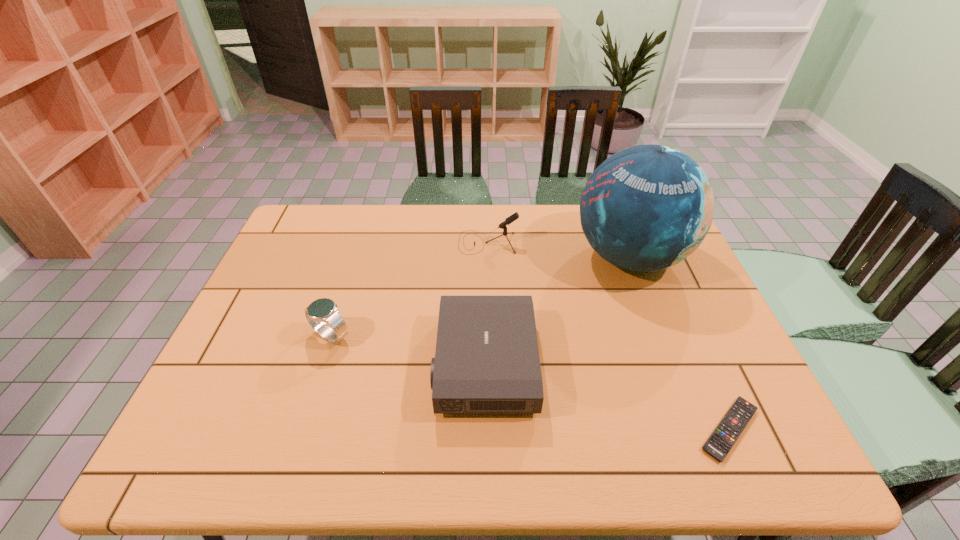
This screenshot has height=540, width=960. What are the coordinates of `the tallest object` in the screenshot? It's located at (648, 207).

The image size is (960, 540). Find the location of `microphone`. microphone is located at coordinates (513, 217).

This screenshot has width=960, height=540. Identify the location of the leftmost object. (322, 310).

Identify the location of projector. (487, 361).

Find the location of `remote control`. remote control is located at coordinates (720, 442).

Locate an element on the screen. This screenshot has height=540, width=960. free location located 0.280m on the left of the tallest object is located at coordinates (484, 257).

The height and width of the screenshot is (540, 960). In order to click on vacant area located on the stand of the microphone in this screenshot , I will do `click(380, 242)`.

Where is `vacant point located on the stand of the microphone`? Image resolution: width=960 pixels, height=540 pixels. vacant point located on the stand of the microphone is located at coordinates (337, 242).

Where is `vacant position located on the stand of the microphone`? This screenshot has width=960, height=540. vacant position located on the stand of the microphone is located at coordinates (352, 242).

Locate an element on the screen. free space located 0.250m on the front of the leftmost object is located at coordinates (297, 444).